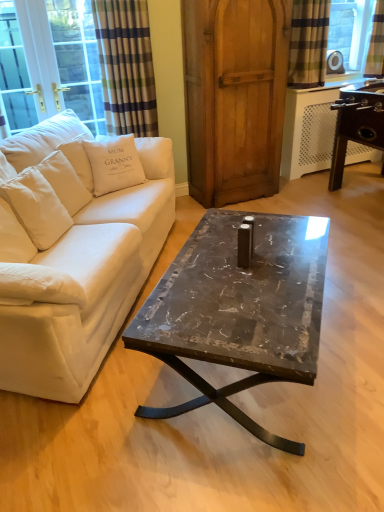
Question: Is plaid fabric curtain at upper right, which is the 3th curtain in left-to-right order, facing away from plaid fabric curtain at upper left, the third curtain positioned from the right?

Choices:
 (A) yes
 (B) no

Answer: (B)

Question: Is plaid fabric curtain at upper right, which is the 3th curtain in left-to-right order, shorter than plaid fabric curtain at upper left, the 1th curtain from the left?

Choices:
 (A) yes
 (B) no

Answer: (A)

Question: Is plaid fabric curtain at upper right, positioned as the first curtain in right-to-left order, completely or partially outside of plaid fabric curtain at upper left, the third curtain positioned from the right?

Choices:
 (A) yes
 (B) no

Answer: (A)

Question: Would you say plaid fabric curtain at upper left, the 1th curtain from the left, is part of plaid fabric curtain at upper right, which is the 3th curtain in left-to-right order,'s contents?

Choices:
 (A) yes
 (B) no

Answer: (B)

Question: From a real-world perspective, is plaid fabric curtain at upper right, positioned as the first curtain in right-to-left order, positioned under plaid fabric curtain at upper left, the 1th curtain from the left, based on gravity?

Choices:
 (A) no
 (B) yes

Answer: (A)

Question: From the image's perspective, is plaid fabric curtain at upper right, positioned as the first curtain in right-to-left order, under plaid fabric curtain at upper left, the third curtain positioned from the right?

Choices:
 (A) yes
 (B) no

Answer: (B)

Question: Is white cotton pillow at upper left beside wooden armoire at center?

Choices:
 (A) no
 (B) yes

Answer: (A)

Question: Does white cotton pillow at upper left contain wooden armoire at center?

Choices:
 (A) no
 (B) yes

Answer: (A)

Question: From the image's perspective, is white cotton pillow at upper left under wooden armoire at center?

Choices:
 (A) yes
 (B) no

Answer: (A)

Question: Does white cotton pillow at upper left appear on the left side of wooden armoire at center?

Choices:
 (A) no
 (B) yes

Answer: (B)

Question: From a real-world perspective, does white cotton pillow at upper left stand above wooden armoire at center?

Choices:
 (A) no
 (B) yes

Answer: (A)

Question: From the image's perspective, does white cotton pillow at upper left appear higher than wooden armoire at center?

Choices:
 (A) yes
 (B) no

Answer: (B)

Question: Does plaid fabric curtain at upper right, which is the 2th curtain in left-to-right order, have a larger size compared to plaid fabric curtain at upper left, the third curtain positioned from the right?

Choices:
 (A) no
 (B) yes

Answer: (A)